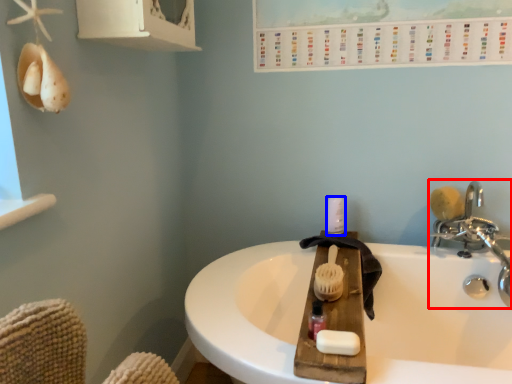
Question: Which of the following is the closest to the observer, tap (highlighted by a red box) or toiletry (highlighted by a blue box)?

Choices:
 (A) tap
 (B) toiletry

Answer: (A)